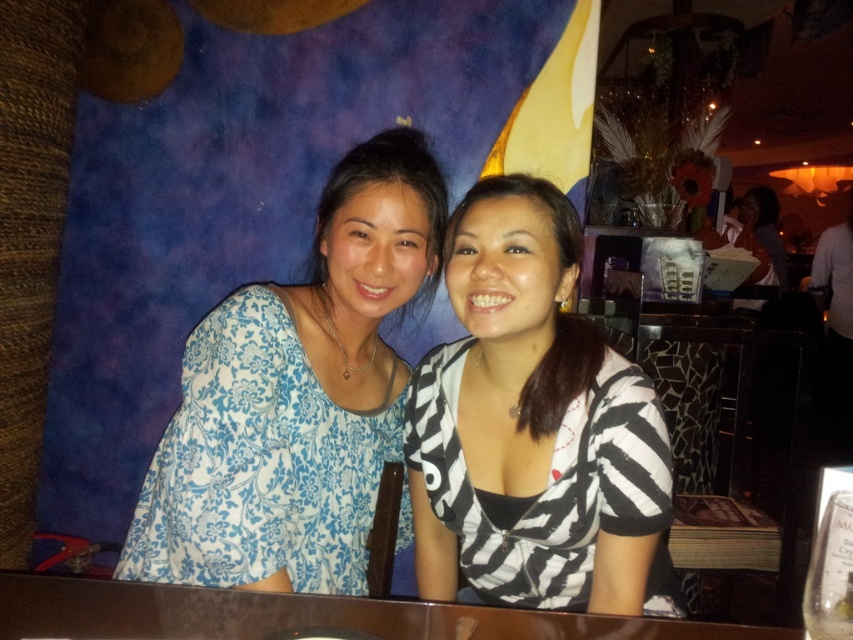
Who is positioned more to the right, zebra print blouse at center or brown wooden table at center?

zebra print blouse at center

Is zebra print blouse at center bigger than brown wooden table at center?

Indeed, zebra print blouse at center has a larger size compared to brown wooden table at center.

Find the location of a particular element. zebra print blouse at center is located at coordinates (532, 426).

Is blue floral blouse at center further to camera compared to brown wooden table at center?

Yes, it is behind brown wooden table at center.

Is point (202, 584) positioned before point (579, 624)?

That is False.

Which is behind, point (339, 525) or point (123, 582)?

Point (339, 525)

This screenshot has width=853, height=640. Identify the location of blue floral blouse at center. (296, 396).

You are a GUI agent. You are given a task and a screenshot of the screen. Output one action in this format:
    pyautogui.click(x=<x>, y=<y>)
    Task: Click on the blue floral blouse at center
    
    Given the screenshot: What is the action you would take?
    pyautogui.click(x=296, y=396)

Is blue floral blouse at center to the left of zebra print blouse at center from the viewer's perspective?

Indeed, blue floral blouse at center is positioned on the left side of zebra print blouse at center.

Find the location of a particular element. blue floral blouse at center is located at coordinates (296, 396).